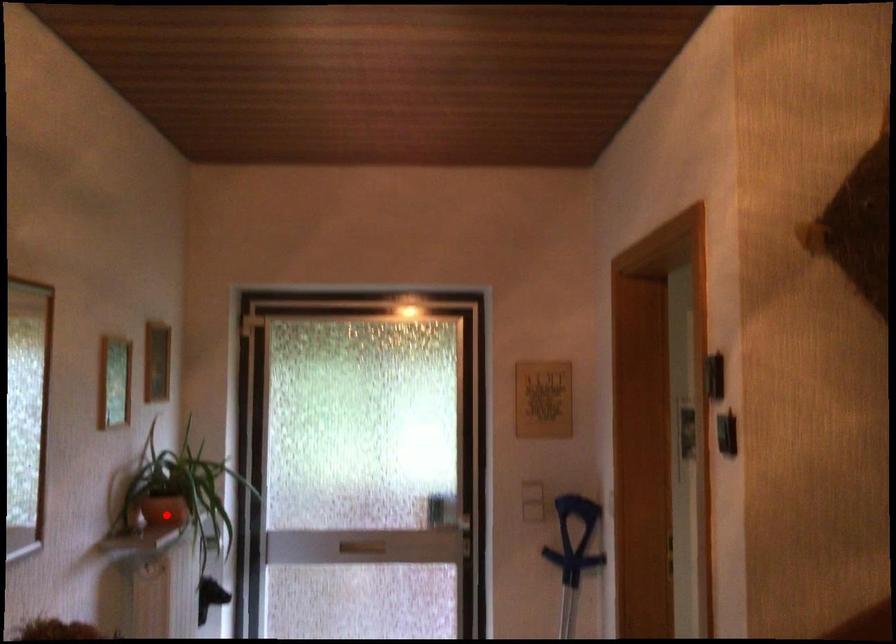
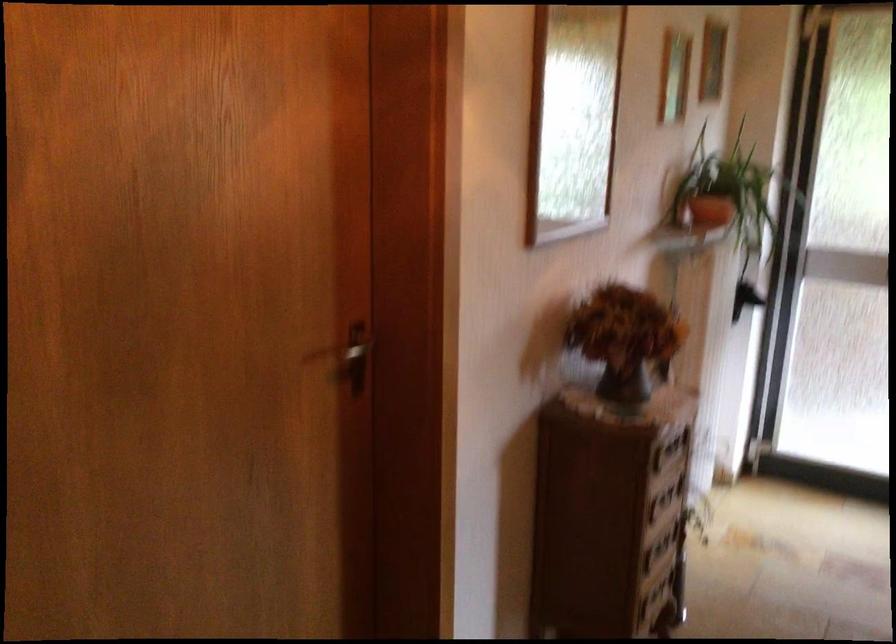
Find the pixel in the second image that matches the highlighted location in the first image.

(711, 211)